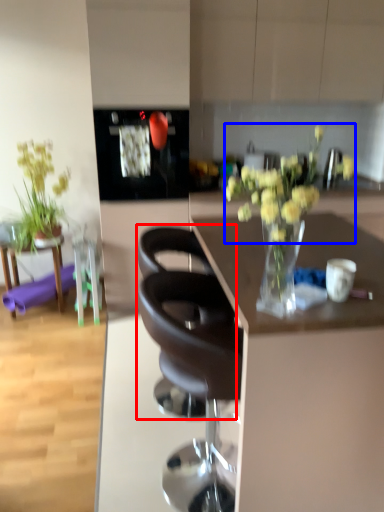
Question: Which object appears farthest to the camera in this image, chair (highlighted by a red box) or flower (highlighted by a blue box)?

Choices:
 (A) chair
 (B) flower

Answer: (A)